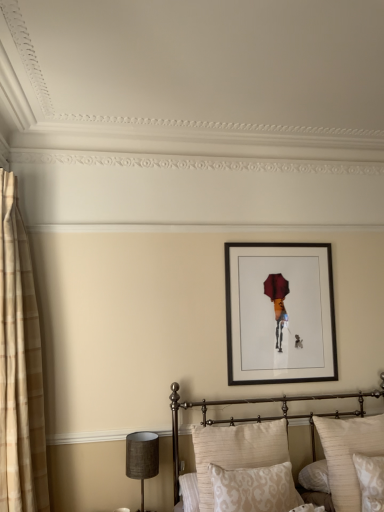
Measure the distance between white damask pillow at lower right, placed as the 3th pillow when sorted from left to right, and camera.

white damask pillow at lower right, placed as the 3th pillow when sorted from left to right, is 7.25 feet away from camera.

Describe the element at coordinates (280, 313) in the screenshot. The height and width of the screenshot is (512, 384). I see `black matte picture frame at upper center` at that location.

Identify the location of black matte picture frame at upper center. The width and height of the screenshot is (384, 512). (280, 313).

At what (x,y) coordinates should I click in order to perform the action: click on neutral fabric pillow at center, the fourth pillow in the right-to-left sequence. Please return your answer as a coordinate pair (x, y). Image resolution: width=384 pixels, height=512 pixels. Looking at the image, I should click on (236, 450).

This screenshot has height=512, width=384. Find the location of `beige damask pillow at lower center, arranged as the second pillow when viewed from the left`. beige damask pillow at lower center, arranged as the second pillow when viewed from the left is located at coordinates (254, 489).

The width and height of the screenshot is (384, 512). Find the location of `beige textured pillow at lower right, the 1th pillow when ordered from right to left`. beige textured pillow at lower right, the 1th pillow when ordered from right to left is located at coordinates (348, 454).

Is matte brown lampshade at lower left located within neutral fabric pillow at center, the fourth pillow in the right-to-left sequence?

No, matte brown lampshade at lower left is not a part of neutral fabric pillow at center, the fourth pillow in the right-to-left sequence.

Considering the sizes of objects neutral fabric pillow at center, the first pillow viewed from the left, and matte brown lampshade at lower left in the image provided, who is shorter, neutral fabric pillow at center, the first pillow viewed from the left, or matte brown lampshade at lower left?

Standing shorter between the two is matte brown lampshade at lower left.

From a real-world perspective, is neutral fabric pillow at center, the fourth pillow in the right-to-left sequence, under matte brown lampshade at lower left?

No.

Which of these two, white damask pillow at lower right, marked as the second pillow in a right-to-left arrangement, or beige damask pillow at lower center, the third pillow positioned from the right, stands taller?

white damask pillow at lower right, marked as the second pillow in a right-to-left arrangement, is taller.

Does white damask pillow at lower right, placed as the 3th pillow when sorted from left to right, have a lesser width compared to beige damask pillow at lower center, arranged as the second pillow when viewed from the left?

Yes, white damask pillow at lower right, placed as the 3th pillow when sorted from left to right, is thinner than beige damask pillow at lower center, arranged as the second pillow when viewed from the left.

From a real-world perspective, which is physically above, white damask pillow at lower right, marked as the second pillow in a right-to-left arrangement, or beige damask pillow at lower center, the third pillow positioned from the right?

In real-world perspective, beige damask pillow at lower center, the third pillow positioned from the right, is above.

Is point (375, 475) closer to viewer compared to point (247, 476)?

No, it is not.

From the image's perspective, which is below, metallic gold bed at center or matte brown lampshade at lower left?

matte brown lampshade at lower left appears lower in the image.

Considering the positions of point (206, 416) and point (130, 446), is point (206, 416) closer or farther from the camera than point (130, 446)?

Point (206, 416).

From a real-world perspective, between metallic gold bed at center and matte brown lampshade at lower left, who is vertically higher?

From a 3D spatial view, metallic gold bed at center is above.

Is metallic gold bed at center smaller than matte brown lampshade at lower left?

No, metallic gold bed at center is not smaller than matte brown lampshade at lower left.

Is there a large distance between matte brown lampshade at lower left and neutral fabric pillow at center, the first pillow viewed from the left?

matte brown lampshade at lower left is near neutral fabric pillow at center, the first pillow viewed from the left, not far away.

From a real-world perspective, between matte brown lampshade at lower left and neutral fabric pillow at center, the fourth pillow in the right-to-left sequence, who is vertically lower?

matte brown lampshade at lower left, from a real-world perspective.

Consider the image. In terms of width, does matte brown lampshade at lower left look wider or thinner when compared to neutral fabric pillow at center, the fourth pillow in the right-to-left sequence?

In the image, matte brown lampshade at lower left appears to be more narrow than neutral fabric pillow at center, the fourth pillow in the right-to-left sequence.

Looking at this image, would you say matte brown lampshade at lower left is outside neutral fabric pillow at center, the first pillow viewed from the left?

Indeed, matte brown lampshade at lower left is completely outside neutral fabric pillow at center, the first pillow viewed from the left.

Is neutral fabric pillow at center, the fourth pillow in the right-to-left sequence, wider than white damask pillow at lower right, placed as the 3th pillow when sorted from left to right?

Indeed, neutral fabric pillow at center, the fourth pillow in the right-to-left sequence, has a greater width compared to white damask pillow at lower right, placed as the 3th pillow when sorted from left to right.

Looking at this image, does neutral fabric pillow at center, the fourth pillow in the right-to-left sequence, have a larger size compared to white damask pillow at lower right, marked as the second pillow in a right-to-left arrangement?

Indeed, neutral fabric pillow at center, the fourth pillow in the right-to-left sequence, has a larger size compared to white damask pillow at lower right, marked as the second pillow in a right-to-left arrangement.

The height and width of the screenshot is (512, 384). Find the location of `the 1st pillow behind when counting from the white damask pillow at lower right, marked as the second pillow in a right-to-left arrangement`. the 1st pillow behind when counting from the white damask pillow at lower right, marked as the second pillow in a right-to-left arrangement is located at coordinates (236, 450).

From the image's perspective, which one is positioned higher, neutral fabric pillow at center, the first pillow viewed from the left, or white damask pillow at lower right, marked as the second pillow in a right-to-left arrangement?

neutral fabric pillow at center, the first pillow viewed from the left, is shown above in the image.

From the image's perspective, which one is positioned higher, metallic gold bed at center or beige plaid curtain at left?

beige plaid curtain at left.

Which object is wider, metallic gold bed at center or beige plaid curtain at left?

Wider between the two is metallic gold bed at center.

Between point (187, 403) and point (0, 456), which one is positioned behind?

Positioned behind is point (187, 403).

Where is `bed in front of the beige plaid curtain at left`? bed in front of the beige plaid curtain at left is located at coordinates click(x=258, y=416).

Is white damask pillow at lower right, marked as the second pillow in a right-to-left arrangement, smaller than metallic gold bed at center?

Yes, white damask pillow at lower right, marked as the second pillow in a right-to-left arrangement, is smaller than metallic gold bed at center.

What's the angular difference between white damask pillow at lower right, marked as the second pillow in a right-to-left arrangement, and metallic gold bed at center's facing directions?

3.63 degrees separate the facing orientations of white damask pillow at lower right, marked as the second pillow in a right-to-left arrangement, and metallic gold bed at center.

Is white damask pillow at lower right, marked as the second pillow in a right-to-left arrangement, wider than metallic gold bed at center?

No, white damask pillow at lower right, marked as the second pillow in a right-to-left arrangement, is not wider than metallic gold bed at center.

Is the position of white damask pillow at lower right, placed as the 3th pillow when sorted from left to right, less distant than that of metallic gold bed at center?

No, the depth of white damask pillow at lower right, placed as the 3th pillow when sorted from left to right, is greater than that of metallic gold bed at center.

Image resolution: width=384 pixels, height=512 pixels. Find the location of `table lamp behind the neutral fabric pillow at center, the fourth pillow in the right-to-left sequence`. table lamp behind the neutral fabric pillow at center, the fourth pillow in the right-to-left sequence is located at coordinates (142, 457).

I want to click on the 1st pillow to the right when counting from the beige damask pillow at lower center, the third pillow positioned from the right, so click(370, 481).

Looking at the image, which one is located closer to white damask pillow at lower right, placed as the 3th pillow when sorted from left to right, beige textured pillow at lower right, which is the 4th pillow from left to right, or metallic gold bed at center?

beige textured pillow at lower right, which is the 4th pillow from left to right, lies closer to white damask pillow at lower right, placed as the 3th pillow when sorted from left to right, than the other object.

Consider the image. Which object lies further to the anchor point matte brown lampshade at lower left, black matte picture frame at upper center or metallic gold bed at center?

black matte picture frame at upper center is further to matte brown lampshade at lower left.

Which object lies further to the anchor point metallic gold bed at center, beige textured pillow at lower right, the 1th pillow when ordered from right to left, or beige damask pillow at lower center, the third pillow positioned from the right?

beige damask pillow at lower center, the third pillow positioned from the right, lies further to metallic gold bed at center than the other object.

From the image, which object appears to be nearer to beige plaid curtain at left, metallic gold bed at center or white damask pillow at lower right, marked as the second pillow in a right-to-left arrangement?

metallic gold bed at center is closer to beige plaid curtain at left.

Estimate the real-world distances between objects in this image. Which object is closer to metallic gold bed at center, beige textured pillow at lower right, the 1th pillow when ordered from right to left, or beige plaid curtain at left?

beige textured pillow at lower right, the 1th pillow when ordered from right to left.

Looking at the image, which one is located closer to matte brown lampshade at lower left, white damask pillow at lower right, marked as the second pillow in a right-to-left arrangement, or beige plaid curtain at left?

Among the two, beige plaid curtain at left is located nearer to matte brown lampshade at lower left.

Which object lies further to the anchor point neutral fabric pillow at center, the fourth pillow in the right-to-left sequence, matte brown lampshade at lower left or metallic gold bed at center?

matte brown lampshade at lower left is further to neutral fabric pillow at center, the fourth pillow in the right-to-left sequence.

Looking at the image, which one is located closer to white damask pillow at lower right, placed as the 3th pillow when sorted from left to right, matte brown lampshade at lower left or beige textured pillow at lower right, the 1th pillow when ordered from right to left?

beige textured pillow at lower right, the 1th pillow when ordered from right to left, is closer to white damask pillow at lower right, placed as the 3th pillow when sorted from left to right.

Locate an element on the screen. This screenshot has height=512, width=384. table lamp between beige plaid curtain at left and white damask pillow at lower right, placed as the 3th pillow when sorted from left to right is located at coordinates (142, 457).

I want to click on table lamp between beige plaid curtain at left and black matte picture frame at upper center in the horizontal direction, so click(x=142, y=457).

This screenshot has height=512, width=384. Find the location of `bed situated between beige plaid curtain at left and white damask pillow at lower right, marked as the second pillow in a right-to-left arrangement, from left to right`. bed situated between beige plaid curtain at left and white damask pillow at lower right, marked as the second pillow in a right-to-left arrangement, from left to right is located at coordinates (258, 416).

The width and height of the screenshot is (384, 512). I want to click on picture frame situated between beige plaid curtain at left and white damask pillow at lower right, marked as the second pillow in a right-to-left arrangement, from left to right, so click(x=280, y=313).